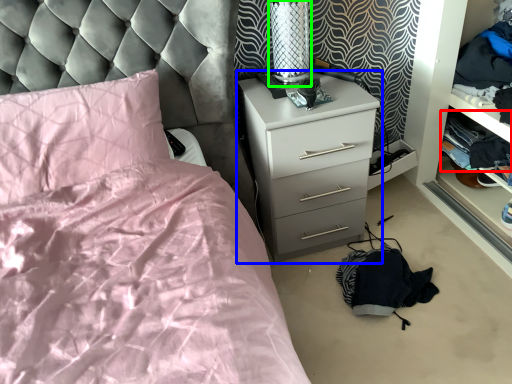
Question: Considering the real-world distances, which object is closest to clothing (highlighted by a red box)? chest of drawers (highlighted by a blue box) or table lamp (highlighted by a green box).

Choices:
 (A) chest of drawers
 (B) table lamp

Answer: (A)